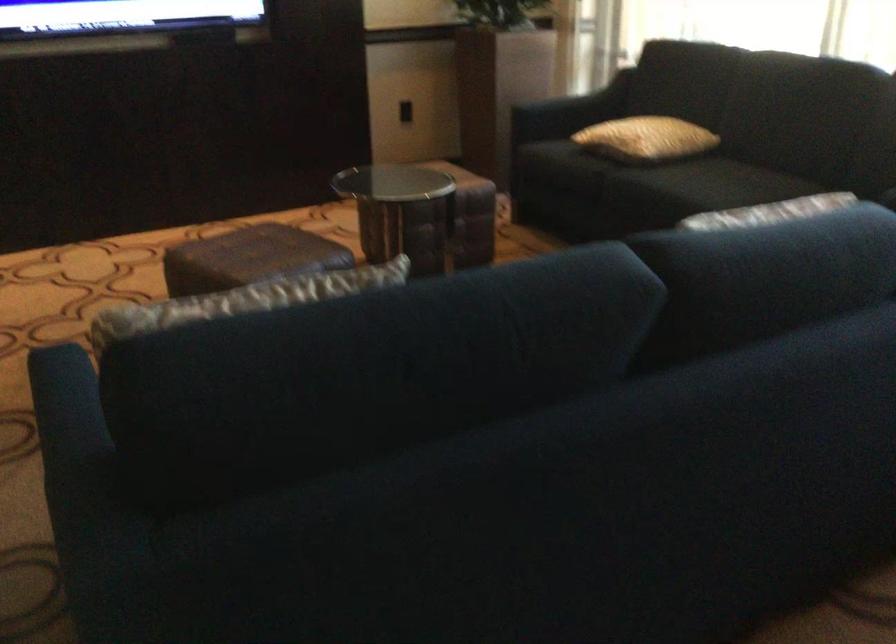
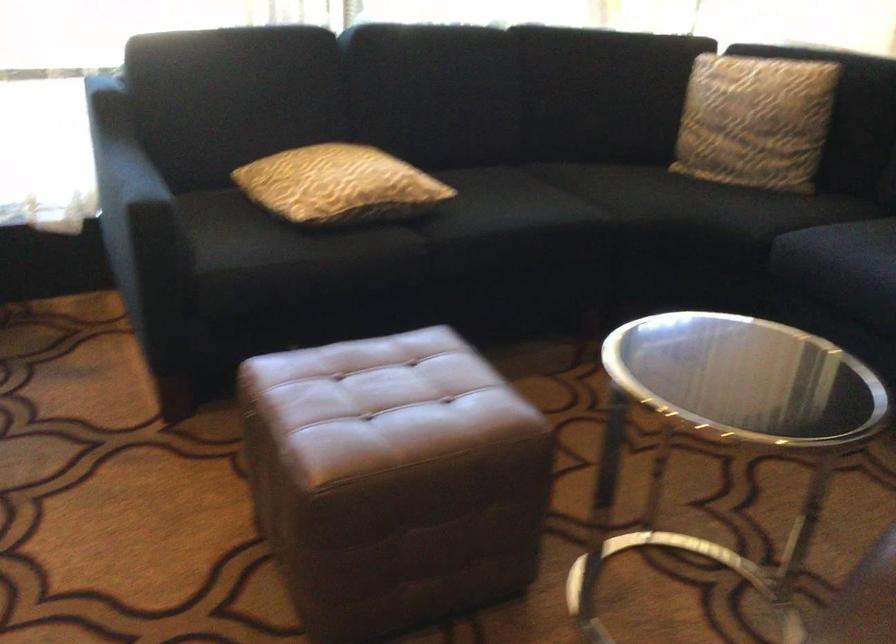
Locate, in the second image, the point that corresponds to the point at 609,127 in the first image.

(339, 185)